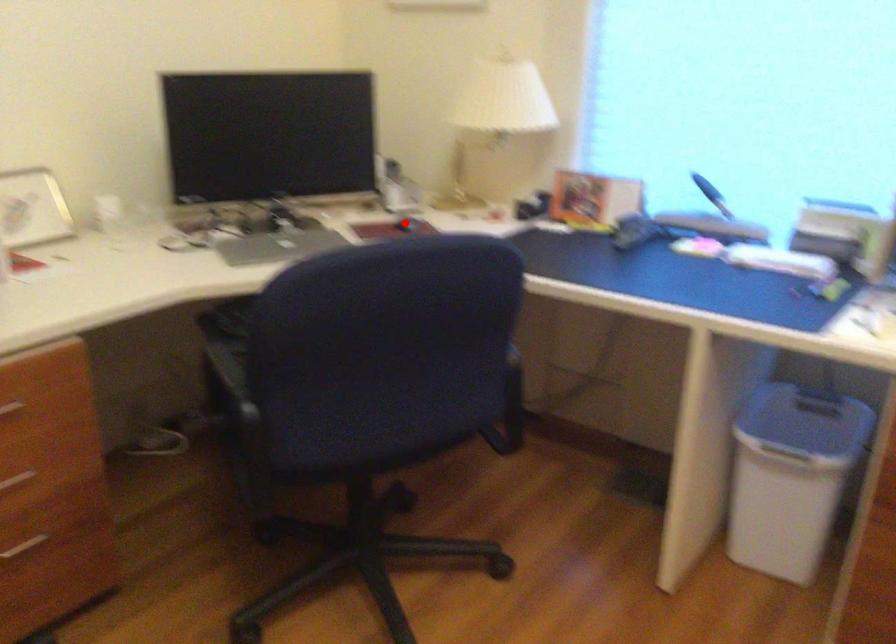
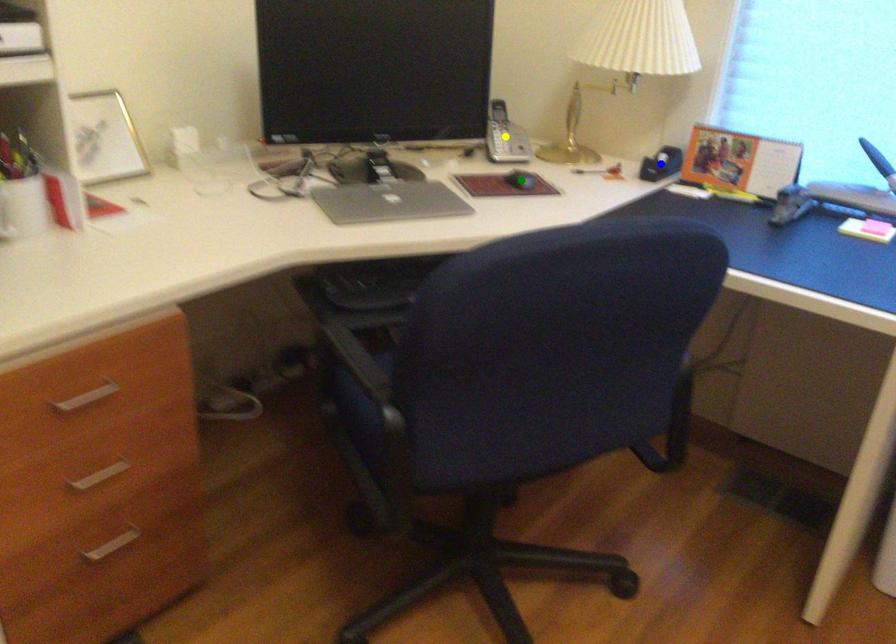
Question: I am providing you with two images of the same scene from different viewpoints. A red point is marked on the first image. You are given multiple points on the second image. Which point in image 2 is actually the same real-world point as the red point in image 1?

Choices:
 (A) yellow point
 (B) blue point
 (C) green point

Answer: (C)